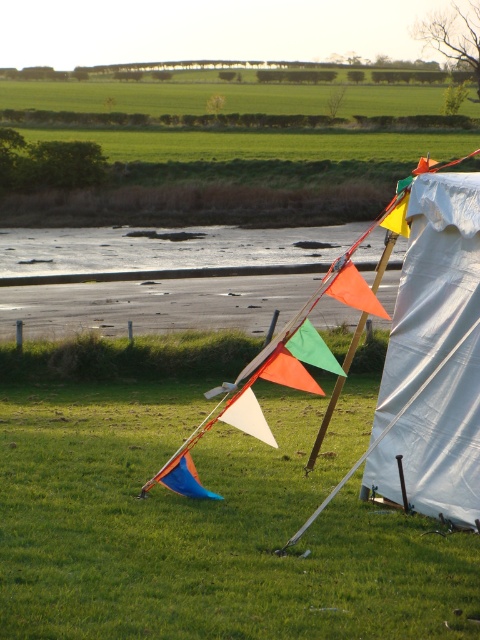
Question: Where is green grass at center located in relation to orange fabric kite at center in the image?

Choices:
 (A) below
 (B) above

Answer: (A)

Question: Does white fabric tent at right lie behind orange fabric kite at center?

Choices:
 (A) yes
 (B) no

Answer: (B)

Question: Which point is closer to the camera?

Choices:
 (A) (338, 278)
 (B) (265, 465)

Answer: (A)

Question: Can you confirm if white fabric tent at right is bigger than orange fabric kite at center?

Choices:
 (A) yes
 (B) no

Answer: (B)

Question: Which of the following is the closest to the observer?

Choices:
 (A) (432, 504)
 (B) (396, 625)

Answer: (B)

Question: Estimate the real-world distances between objects in this image. Which object is farther from the green grass at center?

Choices:
 (A) white fabric tent at right
 (B) orange fabric kite at center

Answer: (A)